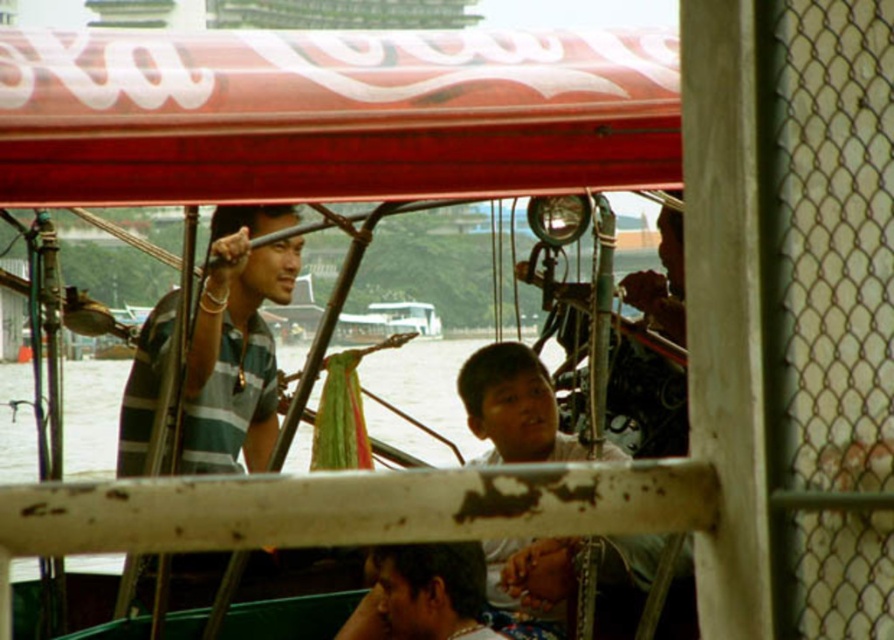
Which is more to the left, clear water at lower left or dark brown skin at lower center?

From the viewer's perspective, clear water at lower left appears more on the left side.

Which is below, clear water at lower left or dark brown skin at lower center?

dark brown skin at lower center is lower down.

Between point (395, 388) and point (372, 604), which one is positioned in front?

Positioned in front is point (372, 604).

Locate an element on the screen. The width and height of the screenshot is (894, 640). clear water at lower left is located at coordinates click(426, 385).

Does green striped shirt at center have a lesser width compared to light brown skin boy at center?

Yes, green striped shirt at center is thinner than light brown skin boy at center.

Is the position of green striped shirt at center less distant than that of light brown skin boy at center?

No.

Is point (140, 438) positioned in front of point (690, 600)?

No, (140, 438) is further to viewer.

At what (x,y) coordinates should I click in order to perform the action: click on green striped shirt at center. Please return your answer as a coordinate pair (x, y). The image size is (894, 640). Looking at the image, I should click on 235,342.

Between point (488, 372) and point (390, 602), which one is positioned behind?

The point (488, 372) is behind.

Is light brown skin boy at center positioned at the back of dark brown skin at lower center?

No, light brown skin boy at center is in front of dark brown skin at lower center.

Which is behind, point (555, 582) or point (412, 609)?

Positioned behind is point (555, 582).

This screenshot has height=640, width=894. What are the coordinates of `light brown skin boy at center` in the screenshot? It's located at (513, 406).